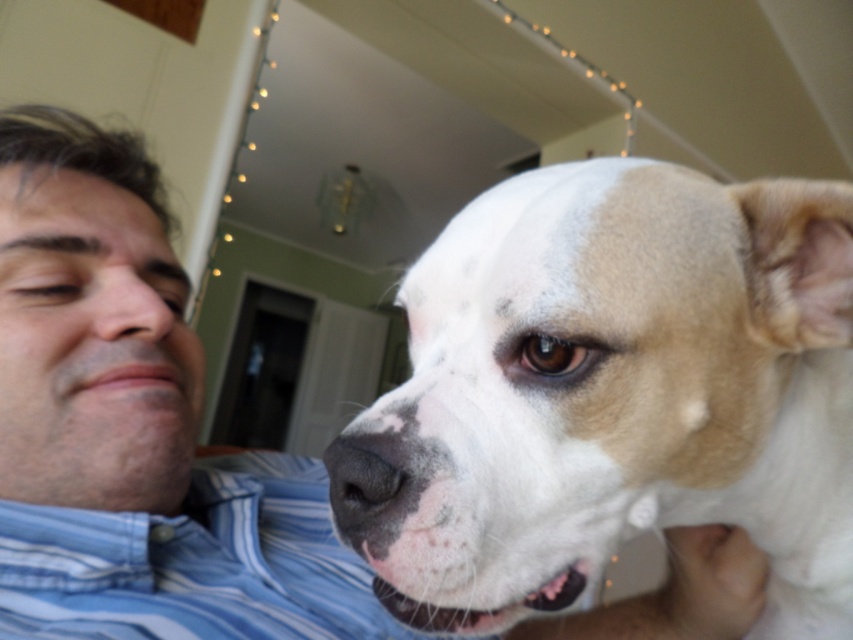
Question: Observing the image, what is the correct spatial positioning of blue striped shirt at lower left in reference to matte skin nose at left?

Choices:
 (A) below
 (B) above

Answer: (A)

Question: Does white fur dog at right appear on the right side of matte skin nose at left?

Choices:
 (A) no
 (B) yes

Answer: (B)

Question: Which object is the closest to the matte skin nose at left?

Choices:
 (A) white fur dog at right
 (B) blue striped shirt at lower left

Answer: (B)

Question: Among these points, which one is nearest to the camera?

Choices:
 (A) (132, 275)
 (B) (833, 307)

Answer: (B)

Question: Which of the following is the farthest from the observer?

Choices:
 (A) matte skin nose at left
 (B) blue striped shirt at lower left
 (C) white fur dog at right

Answer: (A)

Question: Does blue striped shirt at lower left have a lesser width compared to matte skin nose at left?

Choices:
 (A) no
 (B) yes

Answer: (A)